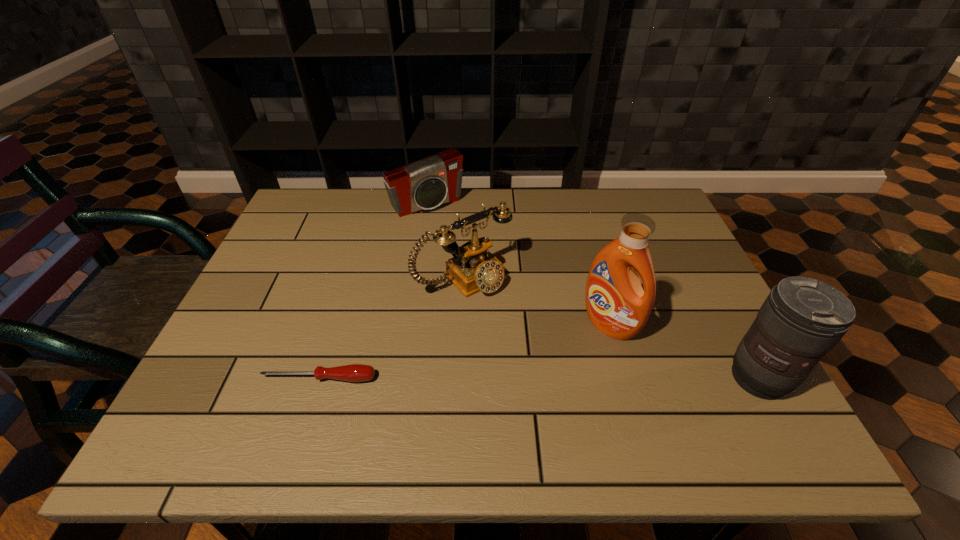
Identify the location of vacant space on the desktop that is between the screwdriver and the rightmost object and is positioned on the front-facing side of the second shortest object. Image resolution: width=960 pixels, height=540 pixels. (560, 378).

Where is `vacant space on the desktop that is between the shortest object and the rightmost object and is positioned on the front-facing side of the second object from right to left`? The image size is (960, 540). vacant space on the desktop that is between the shortest object and the rightmost object and is positioned on the front-facing side of the second object from right to left is located at coordinates (549, 378).

This screenshot has width=960, height=540. I want to click on free space on the desktop that is between the screwdriver and the fourth shortest object and is positioned on the dial number of the second farthest object, so click(560, 378).